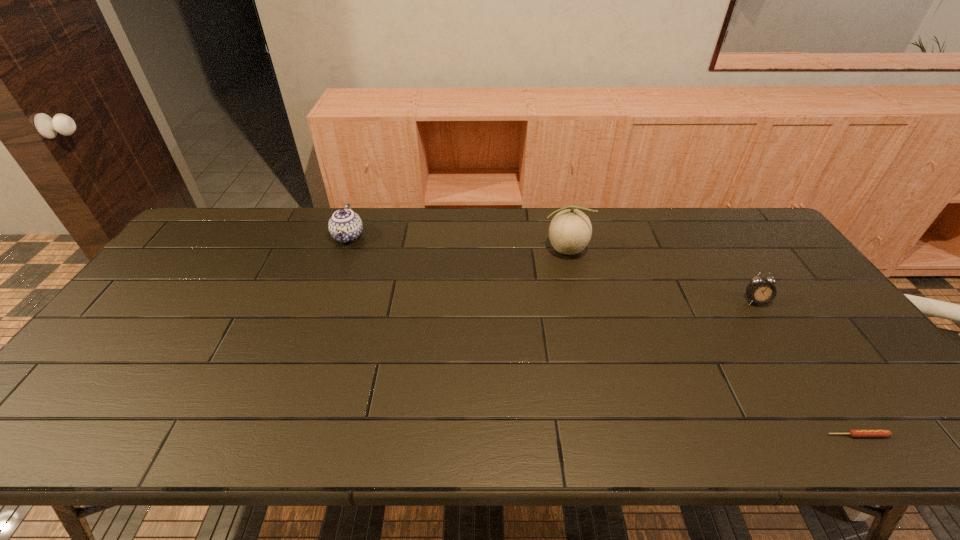
Where is `vacant space at the left edge`? vacant space at the left edge is located at coordinates (125, 348).

You are a GUI agent. You are given a task and a screenshot of the screen. Output one action in this format:
    pyautogui.click(x=<x>, y=<y>)
    Task: Click on the free spot at the right edge of the desktop
    This screenshot has height=540, width=960.
    Given the screenshot: What is the action you would take?
    click(x=779, y=271)

Locate an element on the screen. empty space that is in between the tallest object and the chinaware is located at coordinates (457, 244).

I want to click on free space between the leftmost object and the nearest object, so click(x=603, y=336).

In order to click on unoccupied position between the cantaloup and the shortest object in this screenshot , I will do `click(711, 343)`.

This screenshot has width=960, height=540. Identify the location of free space that is in between the shortest object and the alarm clock. (806, 368).

Locate an element on the screen. The height and width of the screenshot is (540, 960). free spot between the chinaware and the second shortest object is located at coordinates (552, 269).

The height and width of the screenshot is (540, 960). Find the location of `empty location between the third tallest object and the leftmost object`. empty location between the third tallest object and the leftmost object is located at coordinates (552, 269).

This screenshot has height=540, width=960. I want to click on vacant space that's between the shortest object and the second nearest object, so click(806, 368).

Locate an element on the screen. The image size is (960, 540). vacant area between the alarm clock and the nearest object is located at coordinates (806, 368).